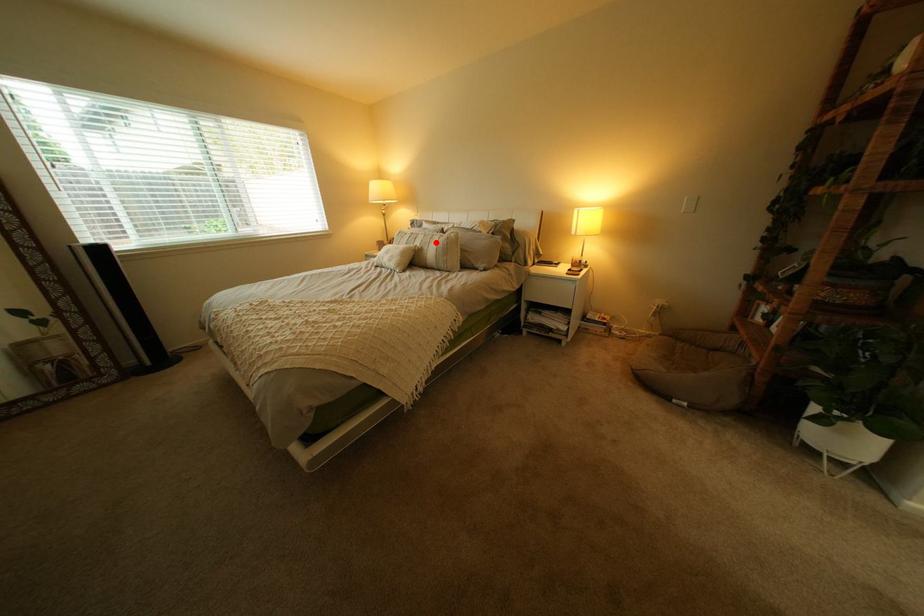
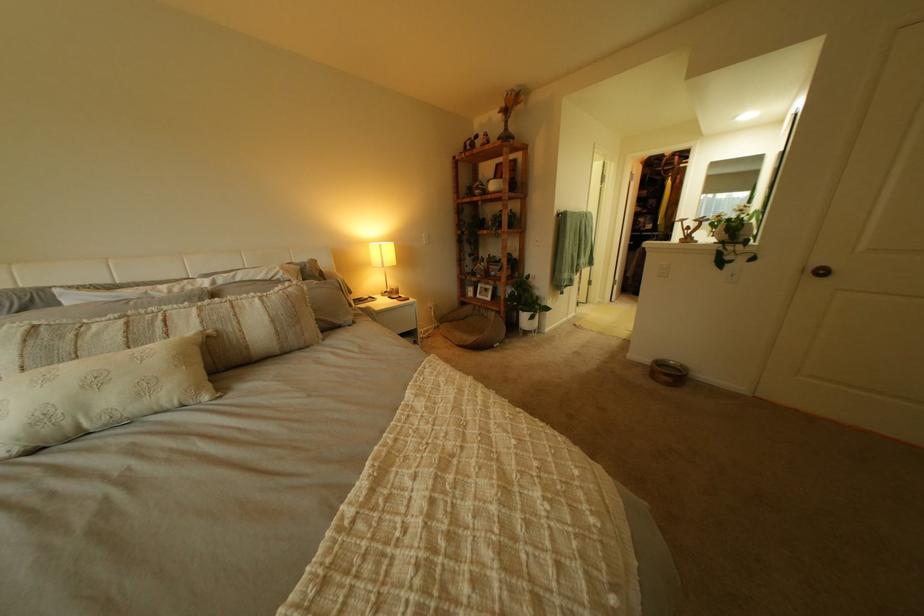
Question: I am providing you with two images of the same scene from different viewpoints. Given a red point in image1, look at the same physical point in image2. Is it:

Choices:
 (A) Closer to the viewpoint
 (B) Farther from the viewpoint

Answer: (B)